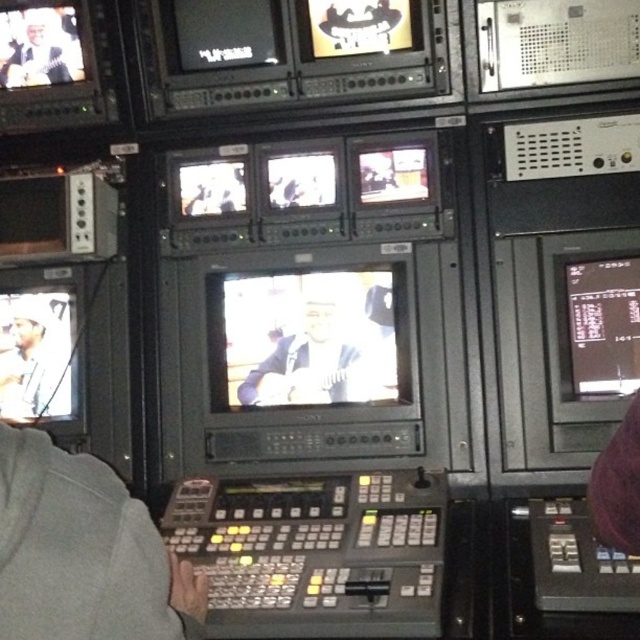
Question: Estimate the real-world distances between objects in this image. Which object is farther from the matte black guitar at upper left?

Choices:
 (A) black glossy monitor at right
 (B) matte black guitar at center
 (C) matte black guitar at left

Answer: (A)

Question: Is matte black guitar at center in front of black glossy monitor at right?

Choices:
 (A) yes
 (B) no

Answer: (B)

Question: Does matte black guitar at left appear under matte black guitar at upper left?

Choices:
 (A) yes
 (B) no

Answer: (A)

Question: Can you confirm if black glossy monitor at right is positioned below matte black guitar at left?

Choices:
 (A) yes
 (B) no

Answer: (B)

Question: Among these points, which one is nearest to the camera?

Choices:
 (A) (360, 378)
 (B) (61, 392)
 (C) (19, 72)

Answer: (A)

Question: Which of these objects is positioned closest to the matte black guitar at upper left?

Choices:
 (A) black glossy monitor at right
 (B) matte black guitar at left

Answer: (B)